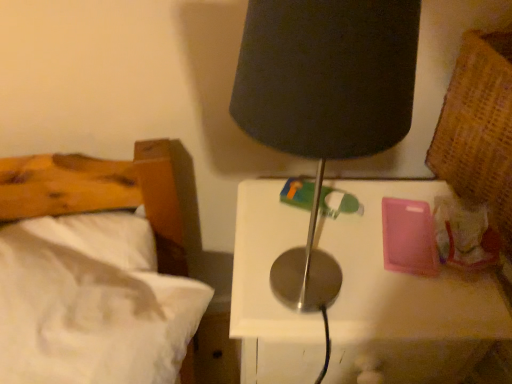
Find the location of a particular element. spots to the right of black fabric lamp at upper center is located at coordinates (396, 293).